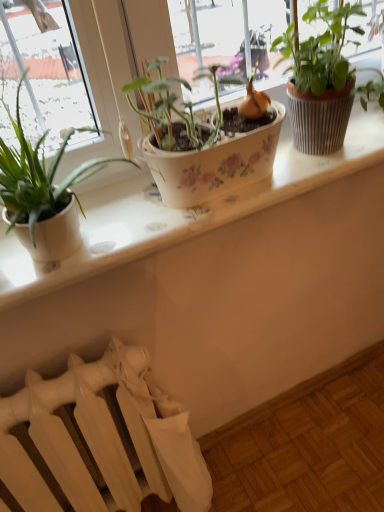
What are the coordinates of `free region under matte white pot at left, which ranks as the 1th houseplant in left-to-right order (from a real-world perspective)` in the screenshot? It's located at (81, 247).